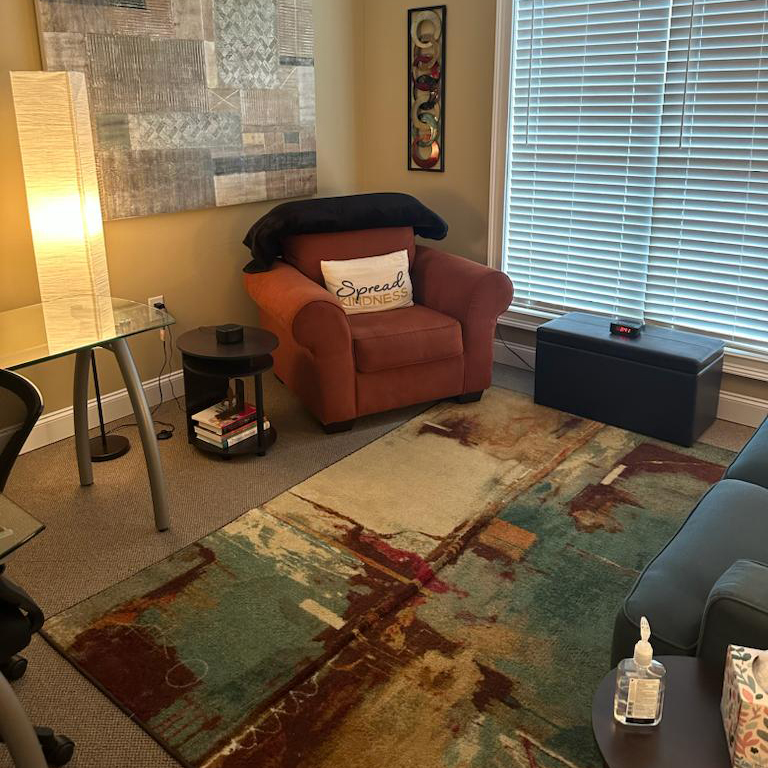
Locate an element on the screen. The height and width of the screenshot is (768, 768). hand sanitizer is located at coordinates (649, 717).